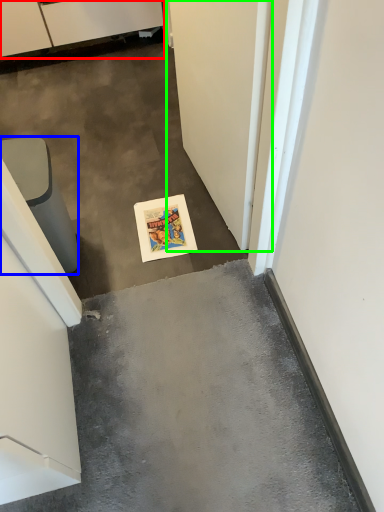
Question: Which object is positioned closest to cabinetry (highlighted by a red box)? Select from furniture (highlighted by a blue box) and door (highlighted by a green box).

Choices:
 (A) furniture
 (B) door

Answer: (A)